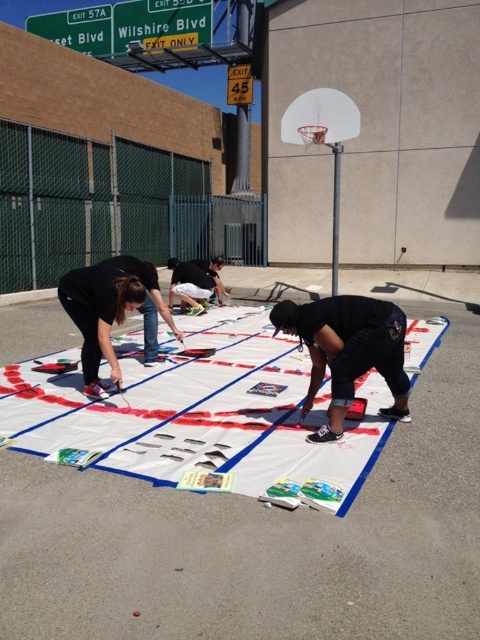
You are a painter standing at the edge of the board. You need to place a ladder to reach both the white plastic basketball hoop at upper right and the black fabric shirt at center. Which object will require the ladder to be placed farther away from you?

The black fabric shirt at center will require the ladder to be placed farther away from you because it occupies more space than the white plastic basketball hoop at upper right.